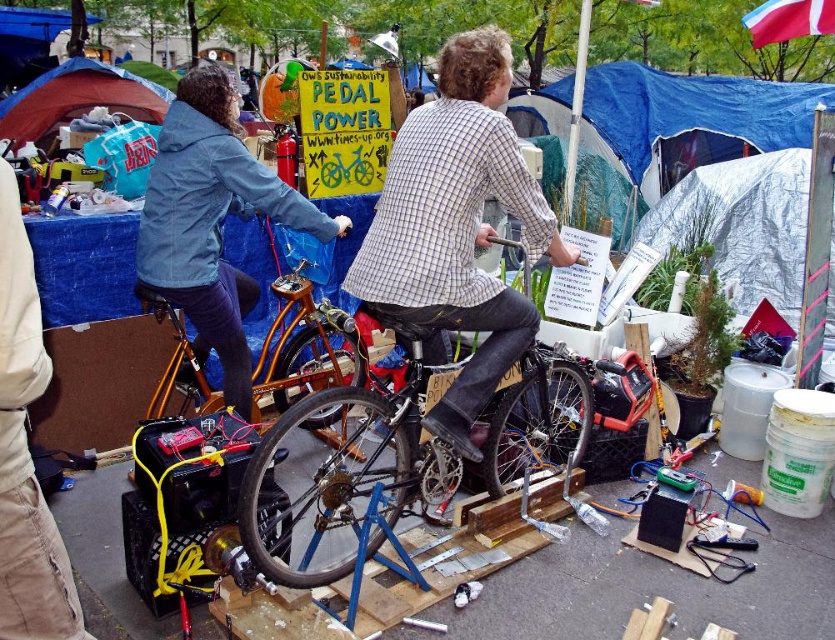
Question: Which point is closer to the camera?

Choices:
 (A) blue tarp tent at upper left
 (B) silver reflective tarp at right

Answer: (B)

Question: Which is farther from the black matte bicycle at center?

Choices:
 (A) silver reflective tarp at right
 (B) blue tarp at upper center
 (C) blue tarp tent at upper left

Answer: (B)

Question: Can you confirm if black matte bicycle at center is positioned to the left of khaki cotton pants at lower left?

Choices:
 (A) yes
 (B) no

Answer: (B)

Question: Which point appears closest to the camera in this image?

Choices:
 (A) (73, 611)
 (B) (152, 90)
 (C) (431, 156)

Answer: (A)

Question: Does checkered shirt at center appear on the left side of black matte bicycle at center?

Choices:
 (A) no
 (B) yes

Answer: (A)

Question: Is checkered shirt at center wider than silver reflective tarp at right?

Choices:
 (A) yes
 (B) no

Answer: (B)